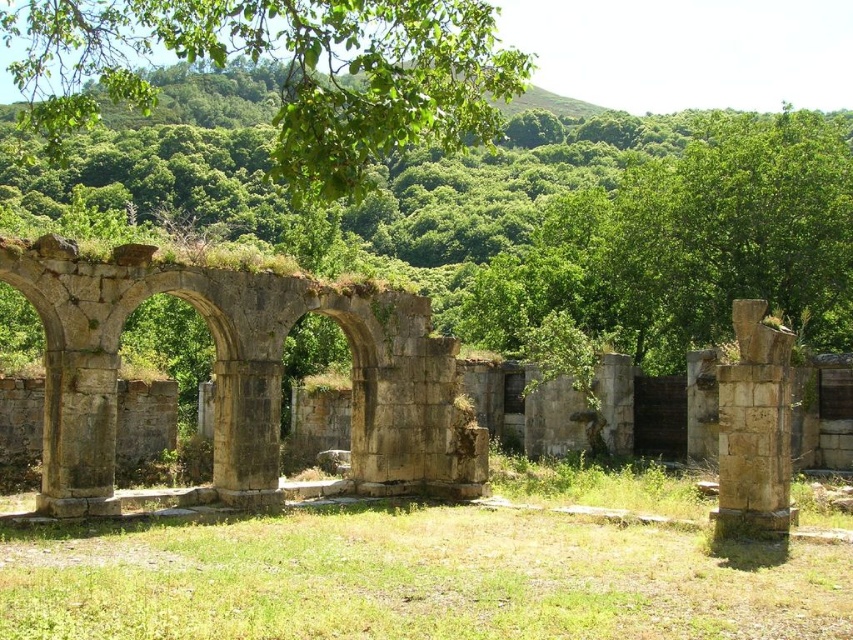
You are an archaeologist examining the ancient stone structure. You notice the stone arches at center and the stone column at right. Which structure is positioned closer to your current viewpoint?

The stone arches at center are closer to the viewer than the stone column at right, so the stone arches at center are positioned closer to your current viewpoint.

You are an archaeologist examining the ancient stone structure. You notice the green leafy tree at center and the stone column at right. Which object is positioned higher in the image?

The green leafy tree at center is located above the stone column at right, so it is positioned higher in the image.

You are an archaeologist examining the ancient stone structure. You notice two green leafy trees in the scene. Which one, the green leafy tree at center or the green leafy tree at upper center, has a larger width?

The green leafy tree at center might be wider than green leafy tree at upper center according to the description.